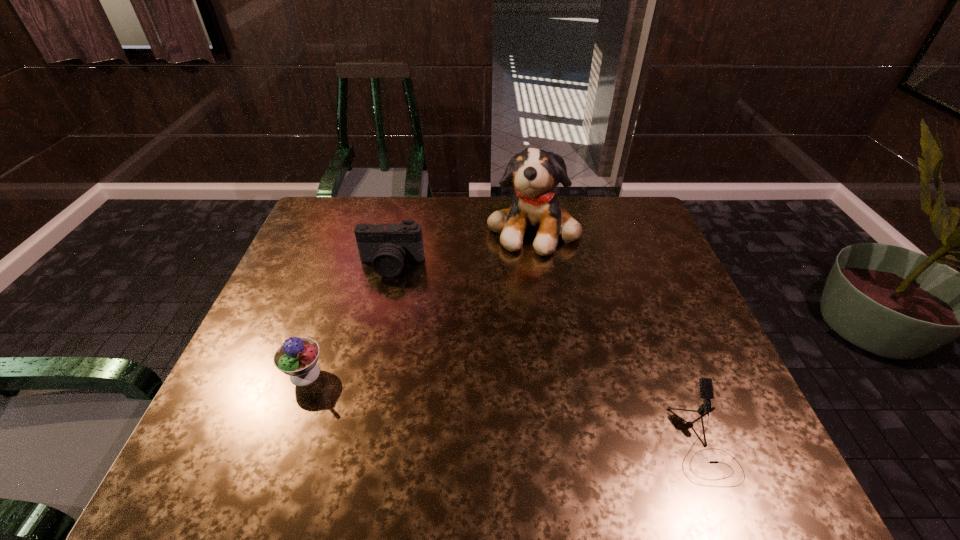
Find the location of a particular element. This screenshot has height=540, width=960. the tallest object is located at coordinates (534, 173).

At what (x,y) coordinates should I click in order to perform the action: click on the third object from left to right. Please return your answer as a coordinate pair (x, y). Looking at the image, I should click on (534, 173).

Locate an element on the screen. camera is located at coordinates (387, 246).

The height and width of the screenshot is (540, 960). I want to click on the third farthest object, so click(297, 357).

You are a GUI agent. You are given a task and a screenshot of the screen. Output one action in this format:
    pyautogui.click(x=<x>, y=<y>)
    Task: Click on the nearest object
    The width and height of the screenshot is (960, 540).
    Given the screenshot: What is the action you would take?
    pyautogui.click(x=706, y=387)

This screenshot has height=540, width=960. What are the coordinates of `the rightmost object` in the screenshot? It's located at (706, 387).

Locate an element on the screen. Image resolution: width=960 pixels, height=540 pixels. free point located at the face of the puppy is located at coordinates (543, 299).

Locate an element on the screen. Image resolution: width=960 pixels, height=540 pixels. free space located 0.260m at the lens of the camera is located at coordinates (372, 350).

In order to click on vacant space located 0.060m on the front of the icecream in this screenshot , I will do `click(290, 416)`.

Where is `object that is at the far edge`? The width and height of the screenshot is (960, 540). object that is at the far edge is located at coordinates (534, 173).